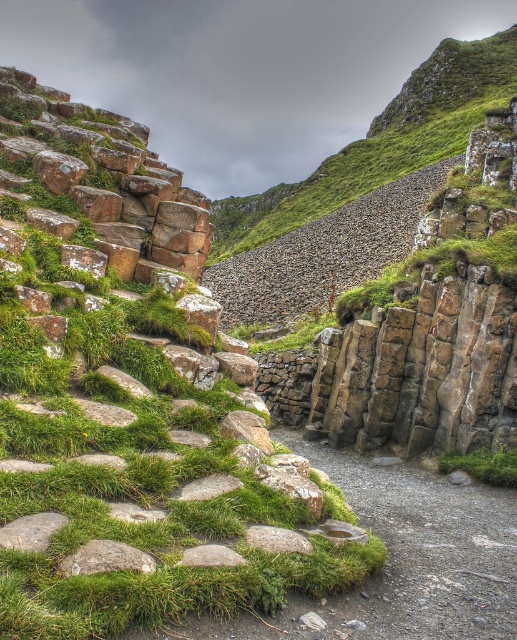
Who is shorter, green mossy stone path at center or green mossy rock at upper center?

With less height is green mossy stone path at center.

Is point (454, 486) positioned after point (241, 204)?

No, it is not.

Identify the location of green mossy stone path at center. The height and width of the screenshot is (640, 517). (419, 552).

Does green mossy rock at left have a greater height compared to green mossy rock at upper center?

No, green mossy rock at left is not taller than green mossy rock at upper center.

Does point (195, 406) lie behind point (454, 129)?

That is False.

Locate an element on the screen. green mossy rock at left is located at coordinates (133, 413).

Can you confirm if green mossy rock at upper center is smaller than green grass at lower center?

Incorrect, green mossy rock at upper center is not smaller in size than green grass at lower center.

From the picture: Who is positioned more to the left, green mossy rock at upper center or green grass at lower center?

From the viewer's perspective, green grass at lower center appears more on the left side.

Which is behind, point (448, 80) or point (440, 460)?

The point (448, 80) is more distant.

The height and width of the screenshot is (640, 517). I want to click on green mossy rock at upper center, so click(382, 141).